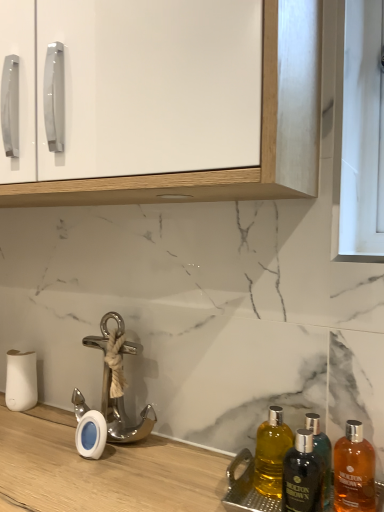
Question: Does polished silver anchor at lower left have a lesser height compared to shiny amber glass bottle at lower right, the third bottle when ordered from left to right?

Choices:
 (A) no
 (B) yes

Answer: (A)

Question: Is polished silver anchor at lower left oriented towards shiny amber glass bottle at lower right, the 1th bottle in the right-to-left sequence?

Choices:
 (A) yes
 (B) no

Answer: (B)

Question: Is polished silver anchor at lower left at the right side of shiny amber glass bottle at lower right, the 1th bottle in the right-to-left sequence?

Choices:
 (A) yes
 (B) no

Answer: (B)

Question: From the image's perspective, does polished silver anchor at lower left appear lower than shiny amber glass bottle at lower right, the third bottle when ordered from left to right?

Choices:
 (A) yes
 (B) no

Answer: (B)

Question: Is polished silver anchor at lower left looking in the opposite direction of shiny amber glass bottle at lower right, the third bottle when ordered from left to right?

Choices:
 (A) no
 (B) yes

Answer: (A)

Question: Based on their positions, is dark brown glass bottle at lower right, the second bottle when ordered from left to right, located to the left or right of shiny amber glass bottle at lower right, the 1th bottle in the right-to-left sequence?

Choices:
 (A) left
 (B) right

Answer: (A)

Question: From a real-world perspective, is dark brown glass bottle at lower right, which is the 2th bottle from right to left, above or below shiny amber glass bottle at lower right, the third bottle when ordered from left to right?

Choices:
 (A) above
 (B) below

Answer: (A)

Question: Do you think dark brown glass bottle at lower right, the second bottle when ordered from left to right, is within shiny amber glass bottle at lower right, the third bottle when ordered from left to right, or outside of it?

Choices:
 (A) inside
 (B) outside

Answer: (B)

Question: Is point (304, 459) closer or farther from the camera than point (347, 480)?

Choices:
 (A) closer
 (B) farther

Answer: (A)

Question: Considering the positions of yellow glass bottle at lower right, which appears as the 1th bottle when viewed from the left, and dark brown glass bottle at lower right, which is the 2th bottle from right to left, in the image, is yellow glass bottle at lower right, which appears as the 1th bottle when viewed from the left, taller or shorter than dark brown glass bottle at lower right, which is the 2th bottle from right to left,?

Choices:
 (A) short
 (B) tall

Answer: (A)

Question: From a real-world perspective, is yellow glass bottle at lower right, the 3th bottle in the right-to-left sequence, physically located above or below dark brown glass bottle at lower right, which is the 2th bottle from right to left?

Choices:
 (A) below
 (B) above

Answer: (A)

Question: From the image's perspective, is yellow glass bottle at lower right, the 3th bottle in the right-to-left sequence, above or below dark brown glass bottle at lower right, the second bottle when ordered from left to right?

Choices:
 (A) above
 (B) below

Answer: (A)

Question: Is yellow glass bottle at lower right, which appears as the 1th bottle when viewed from the left, bigger or smaller than dark brown glass bottle at lower right, the second bottle when ordered from left to right?

Choices:
 (A) small
 (B) big

Answer: (B)

Question: Considering the positions of polished silver anchor at lower left and white glossy cabinet at upper center in the image, is polished silver anchor at lower left bigger or smaller than white glossy cabinet at upper center?

Choices:
 (A) big
 (B) small

Answer: (B)

Question: Looking at their shapes, would you say polished silver anchor at lower left is wider or thinner than white glossy cabinet at upper center?

Choices:
 (A) wide
 (B) thin

Answer: (B)